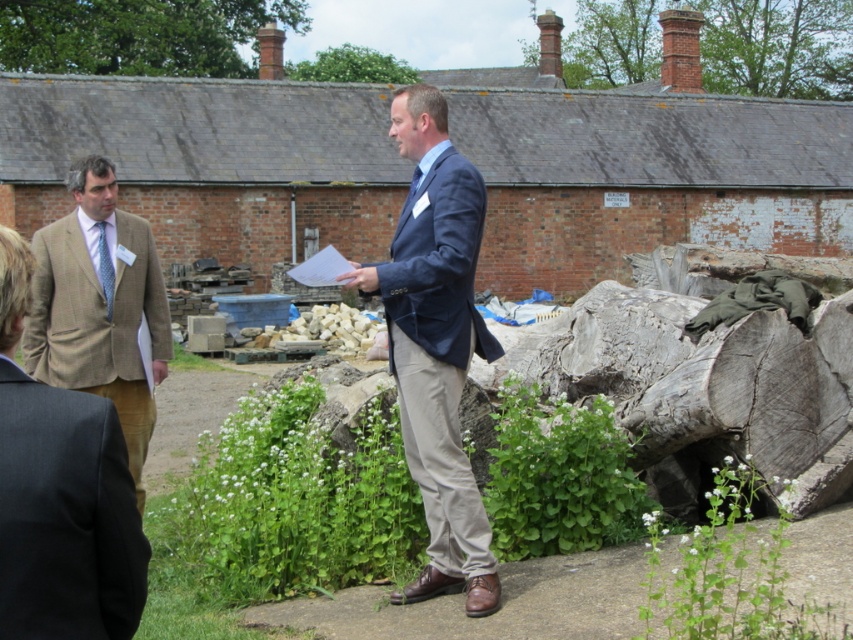
Question: Which point appears closest to the camera in this image?

Choices:
 (A) (439, 307)
 (B) (68, 310)

Answer: (A)

Question: Which of these objects is positioned farthest from the brown tweed suit at left?

Choices:
 (A) velvet blue blazer at center
 (B) brown tweed blazer at left

Answer: (B)

Question: Does velvet blue blazer at center come in front of brown tweed blazer at left?

Choices:
 (A) yes
 (B) no

Answer: (B)

Question: Among these objects, which one is nearest to the camera?

Choices:
 (A) brown tweed blazer at left
 (B) brown tweed suit at left

Answer: (A)

Question: Does velvet blue blazer at center appear under brown tweed blazer at left?

Choices:
 (A) no
 (B) yes

Answer: (A)

Question: Can you confirm if velvet blue blazer at center is positioned above brown tweed suit at left?

Choices:
 (A) no
 (B) yes

Answer: (A)